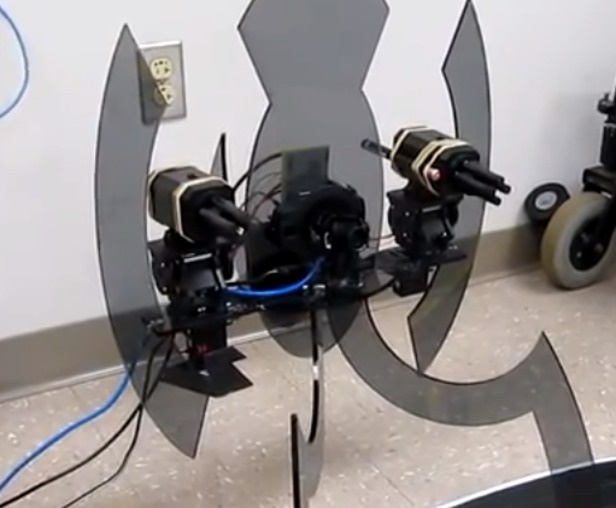
The height and width of the screenshot is (508, 616). I want to click on bottom power outlet, so click(164, 93).